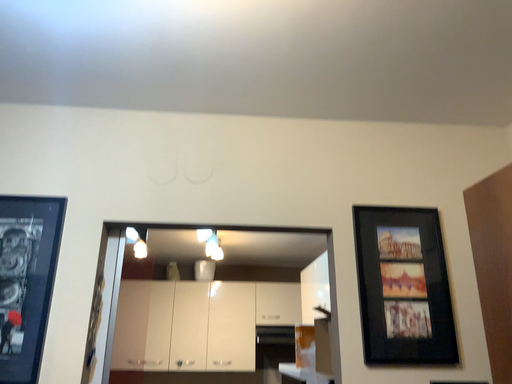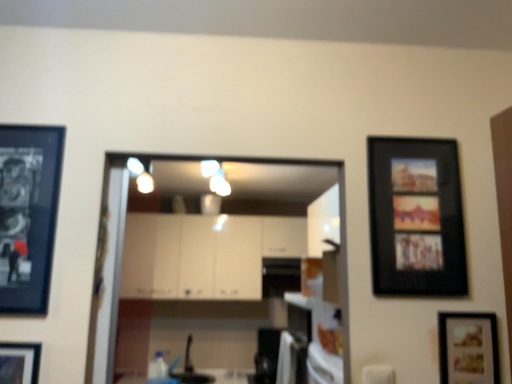
Question: How did the camera likely rotate when shooting the video?

Choices:
 (A) rotated downward
 (B) rotated upward

Answer: (A)